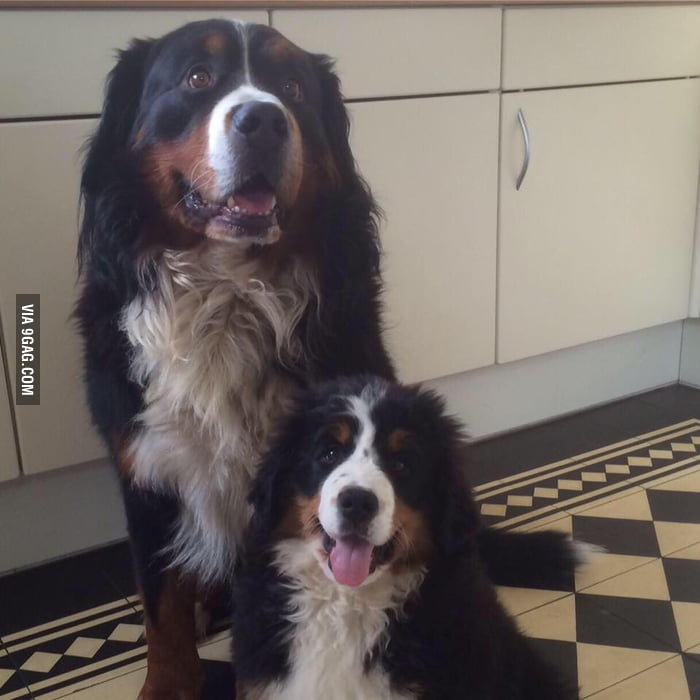
The width and height of the screenshot is (700, 700). I want to click on baseboard, so click(540, 386).